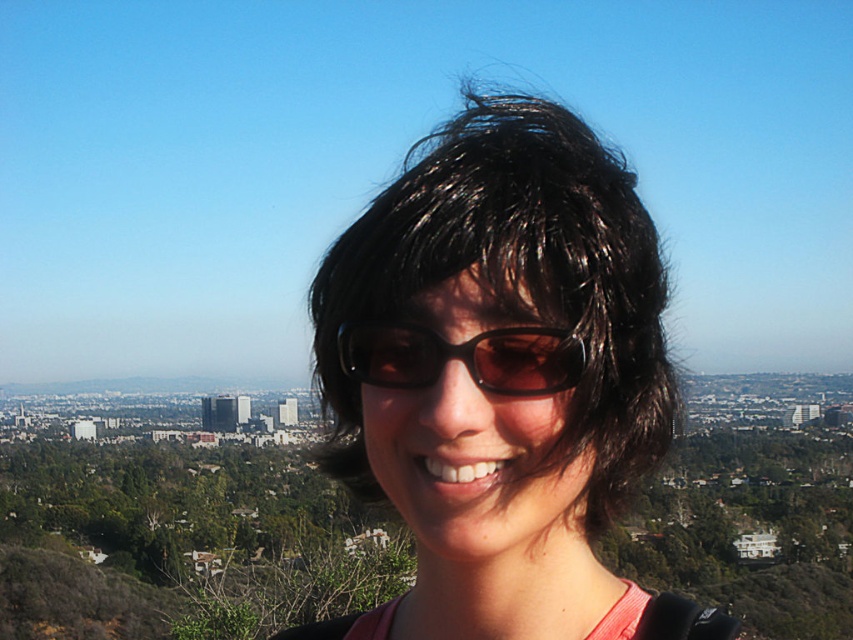
Is shiny black hair at center above black matte sunglasses at center?

No, shiny black hair at center is not above black matte sunglasses at center.

Does point (364, 282) come behind point (442, 346)?

Yes, it is behind point (442, 346).

Locate an element on the screen. The image size is (853, 640). shiny black hair at center is located at coordinates (502, 380).

Find the location of a particular element. shiny black hair at center is located at coordinates (502, 380).